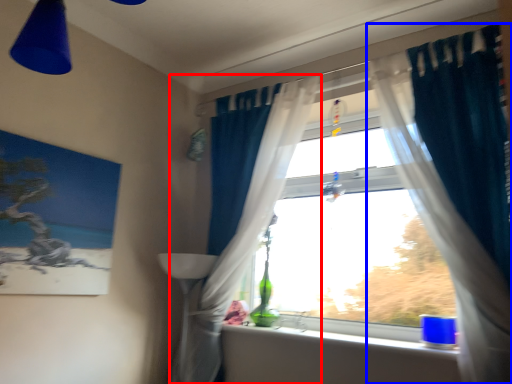
Question: Among these objects, which one is farthest to the camera, curtain (highlighted by a red box) or curtain (highlighted by a blue box)?

Choices:
 (A) curtain
 (B) curtain

Answer: (A)